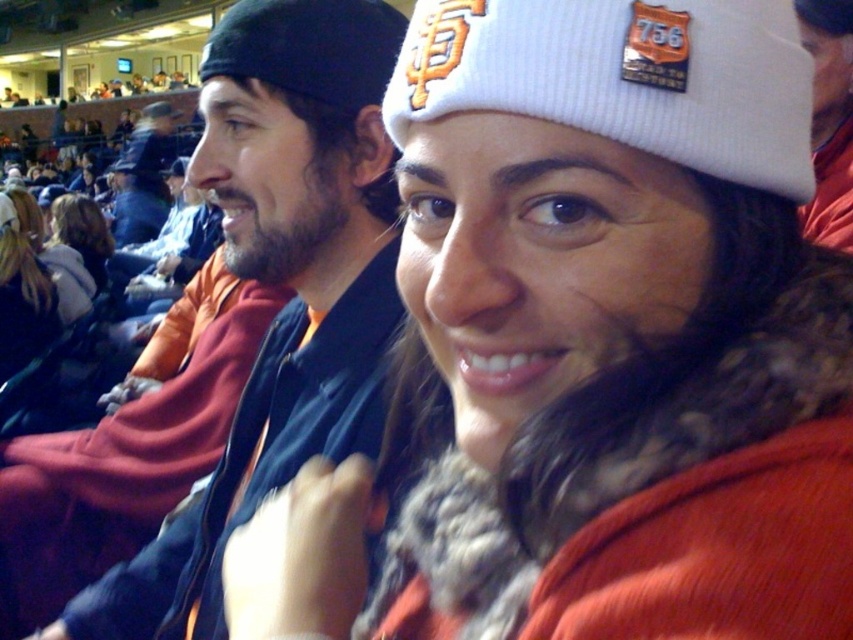
Who is higher up, orange fur-lined jacket at center or white knit cap at upper center?

Positioned higher is white knit cap at upper center.

Does point (573, 156) lie behind point (732, 131)?

That is False.

Where is `orange fur-lined jacket at center`? orange fur-lined jacket at center is located at coordinates (596, 344).

Is blonde hair at center closer to the viewer compared to white fur coat at center?

Yes, it is in front of white fur coat at center.

Image resolution: width=853 pixels, height=640 pixels. What do you see at coordinates (21, 296) in the screenshot? I see `blonde hair at center` at bounding box center [21, 296].

Locate an element on the screen. blonde hair at center is located at coordinates pos(21,296).

Find the location of a particular element. The image size is (853, 640). blonde hair at center is located at coordinates (21, 296).

Consider the image. Between black knit cap at upper center and white fur coat at center, which one is positioned lower?

white fur coat at center is lower down.

The image size is (853, 640). Find the location of `black knit cap at upper center`. black knit cap at upper center is located at coordinates (309, 48).

Between point (228, 40) and point (68, 275), which one is positioned behind?

The point (68, 275) is more distant.

Locate an element on the screen. This screenshot has width=853, height=640. black knit cap at upper center is located at coordinates (309, 48).